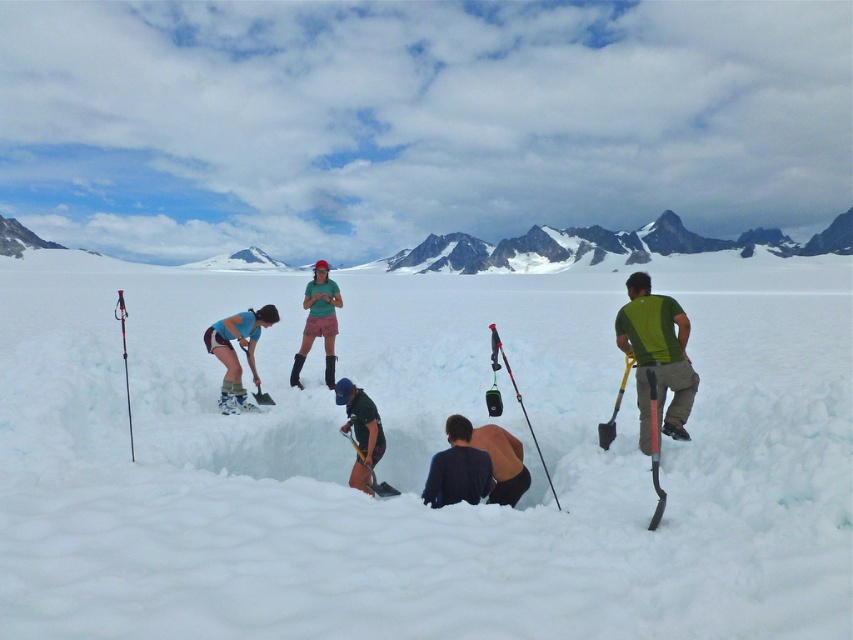
Question: Is matte blue shorts at center behind green fabric shorts at center?

Choices:
 (A) no
 (B) yes

Answer: (A)

Question: Can you confirm if dark blue fabric at center is positioned above green fabric shorts at center?

Choices:
 (A) yes
 (B) no

Answer: (B)

Question: Is dark blue fabric at center positioned behind green fabric shorts at center?

Choices:
 (A) yes
 (B) no

Answer: (B)

Question: Which object appears closest to the camera in this image?

Choices:
 (A) dark blue fabric at center
 (B) white fluffy snow at center
 (C) matte blue shorts at center
 (D) dark green fabric jacket at center

Answer: (B)

Question: Which point appears farthest from the camera in this image?

Choices:
 (A) (453, 499)
 (B) (115, 602)
 (C) (334, 388)
 (D) (657, 310)

Answer: (C)

Question: Which object is farther from the camera taking this photo?

Choices:
 (A) dark blue fabric at center
 (B) matte blue shorts at center
 (C) white fluffy snow at center

Answer: (B)